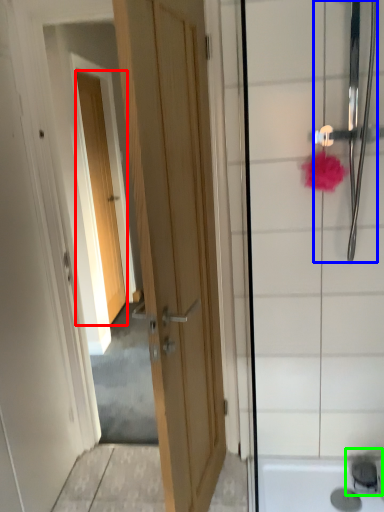
Question: Based on their relative distances, which object is farther from door (highlighted by a red box)? Choose from shower (highlighted by a blue box) and faucet (highlighted by a green box).

Choices:
 (A) shower
 (B) faucet

Answer: (B)